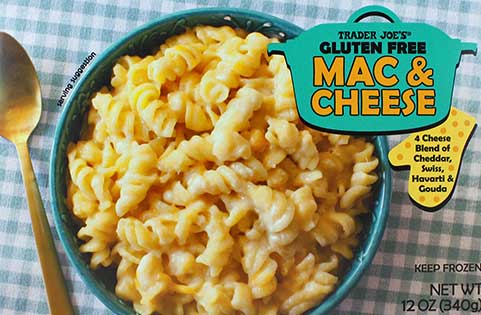
What are the coordinates of `spoon` in the screenshot? It's located at (14, 93).